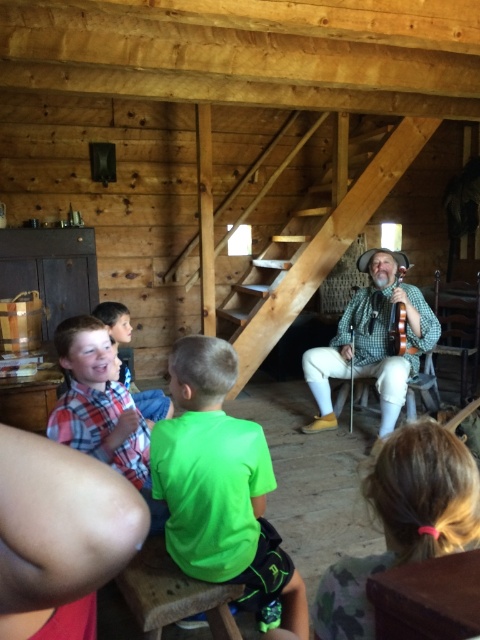
Question: Is plaid cotton shirt at lower left above plaid shirt at lower left?

Choices:
 (A) yes
 (B) no

Answer: (B)

Question: Considering the real-world distances, which object is closest to the plaid shirt at lower left?

Choices:
 (A) green plaid shirt at center
 (B) plaid cotton shirt at lower left

Answer: (B)

Question: Which object is the farthest from the plaid cotton shirt at lower left?

Choices:
 (A) green plaid shirt at center
 (B) plaid shirt at lower left

Answer: (A)

Question: Is green plaid shirt at center positioned before plaid cotton shirt at lower left?

Choices:
 (A) yes
 (B) no

Answer: (B)

Question: Estimate the real-world distances between objects in this image. Which object is closer to the plaid shirt at lower left?

Choices:
 (A) plaid cotton shirt at lower left
 (B) green fabric shirt at center
 (C) green plaid shirt at center

Answer: (A)

Question: Does green fabric shirt at center appear on the right side of plaid cotton shirt at lower left?

Choices:
 (A) no
 (B) yes

Answer: (B)